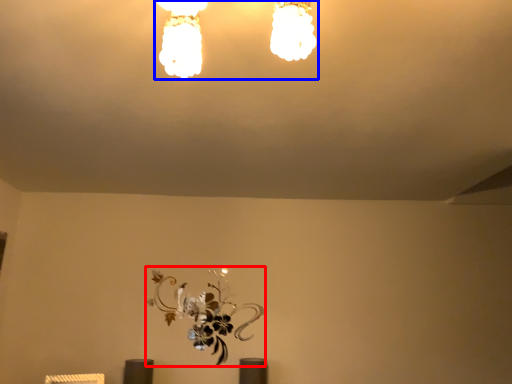
Question: Which object is closer to the camera taking this photo, flower (highlighted by a red box) or lamp (highlighted by a blue box)?

Choices:
 (A) flower
 (B) lamp

Answer: (B)